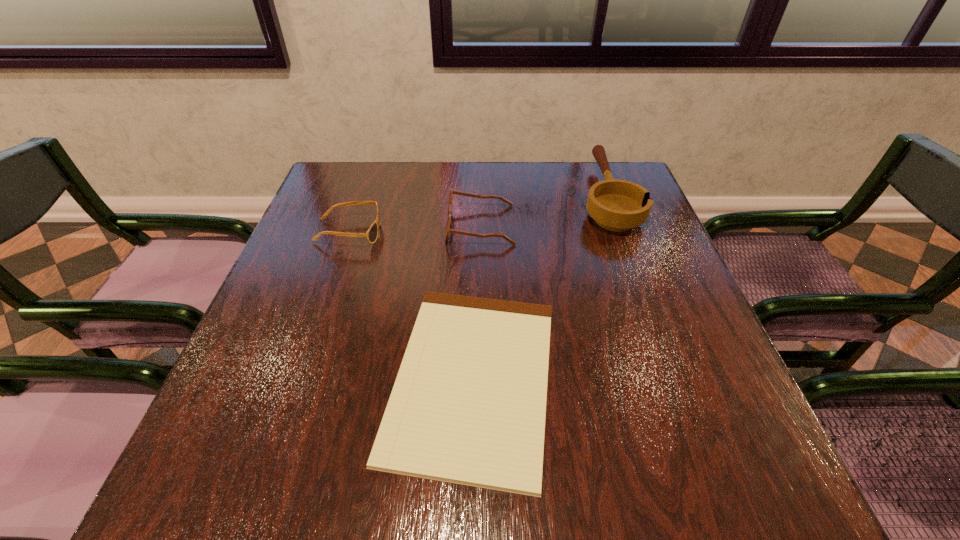
Locate an element on the screen. This screenshot has width=960, height=540. vacant space at the right edge of the desktop is located at coordinates (675, 353).

You are a GUI agent. You are given a task and a screenshot of the screen. Output one action in this format:
    pyautogui.click(x=<x>, y=<y>)
    Task: Click on the vacant area at the far left corner of the desktop
    The image size is (960, 540).
    Given the screenshot: What is the action you would take?
    pyautogui.click(x=337, y=168)

Where is `vacant space at the near right corner`? vacant space at the near right corner is located at coordinates (733, 481).

Locate an element on the screen. free space that is in between the rightmost object and the second shortest object is located at coordinates (477, 214).

In order to click on vacant space that is in between the second shortest object and the spectacles in this screenshot , I will do `click(415, 228)`.

Identify the location of vacant point located between the nearest object and the rightmost object. Image resolution: width=960 pixels, height=540 pixels. (540, 287).

Where is `free space between the spectacles and the rightmost object`? free space between the spectacles and the rightmost object is located at coordinates (543, 211).

I want to click on free space between the leftmost object and the spectacles, so click(x=415, y=228).

The height and width of the screenshot is (540, 960). I want to click on empty space between the leftmost object and the rightmost object, so click(x=477, y=214).

At what (x,y) coordinates should I click in order to perform the action: click on free space between the spectacles and the leftmost object. Please return your answer as a coordinate pair (x, y). Looking at the image, I should click on (415, 228).